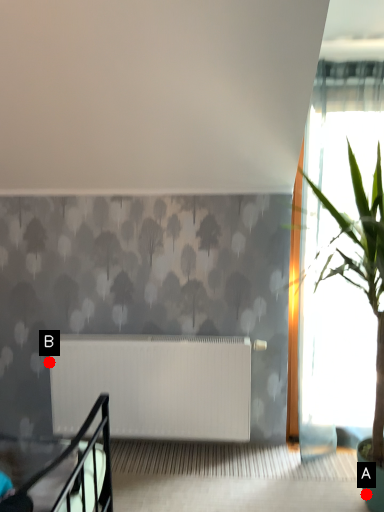
Question: Two points are circled on the image, labeled by A and B beside each circle. Which point is closer to the camera taking this photo?

Choices:
 (A) A is closer
 (B) B is closer

Answer: (A)